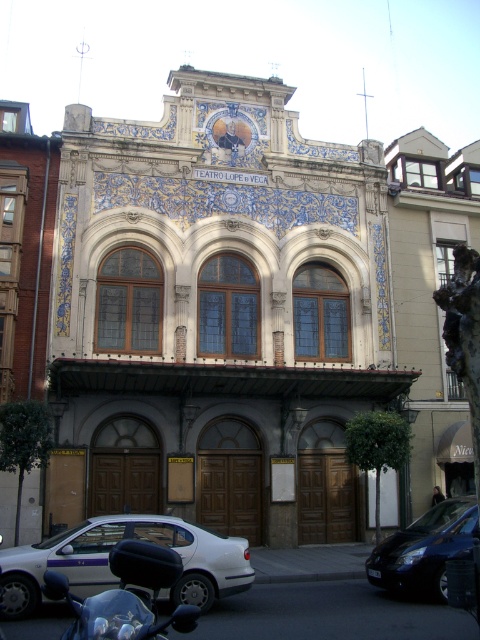
Is point (143, 637) positioned after point (434, 582)?

That is False.

Is black matte motorcycle at lower left further to camera compared to shiny blue car at lower right?

That is False.

Who is more distant from viewer, (x=127, y=563) or (x=420, y=545)?

Positioned behind is point (x=420, y=545).

I want to click on black matte motorcycle at lower left, so click(126, 596).

In the scene shown: Which is more to the left, white glossy sedan at center or shiny blue car at lower right?

From the viewer's perspective, white glossy sedan at center appears more on the left side.

The image size is (480, 640). Describe the element at coordinates (108, 561) in the screenshot. I see `white glossy sedan at center` at that location.

Which is in front, point (238, 584) or point (440, 532)?

Point (238, 584) is in front.

Identify the location of white glossy sedan at center. The height and width of the screenshot is (640, 480). (108, 561).

Who is more distant from viewer, (103, 563) or (154, 577)?

Positioned behind is point (103, 563).

Does white glossy sedan at center have a smaller size compared to black matte motorcycle at lower left?

No.

Between point (28, 609) and point (130, 604), which one is positioned in front?

Point (130, 604)

Locate an element on the screen. The width and height of the screenshot is (480, 640). white glossy sedan at center is located at coordinates (108, 561).